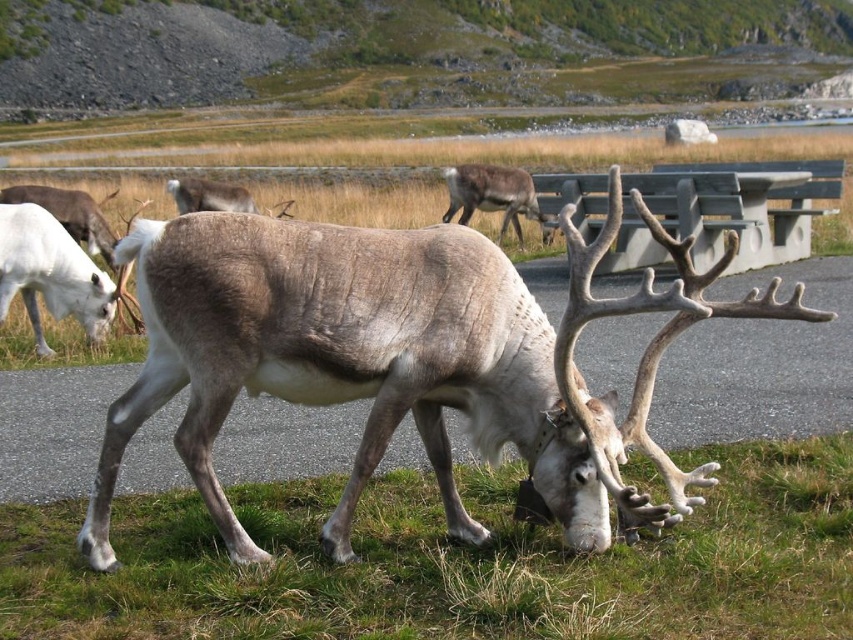
Question: Considering the relative positions of brown fur antlered deer at center and brown fur reindeer at center in the image provided, where is brown fur antlered deer at center located with respect to brown fur reindeer at center?

Choices:
 (A) left
 (B) right

Answer: (A)

Question: Which of the following is the farthest from the observer?

Choices:
 (A) (164, 508)
 (B) (521, 202)
 (C) (416, 291)

Answer: (B)

Question: Which object is positioned farthest from the brown fur reindeer at center?

Choices:
 (A) green grass at lower right
 (B) brown fur antlered deer at center

Answer: (B)

Question: Which object is the farthest from the green grass at lower right?

Choices:
 (A) brown fur reindeer at center
 (B) brown fur antlered deer at center

Answer: (A)

Question: Is the position of green grass at lower right less distant than that of brown fur reindeer at center?

Choices:
 (A) yes
 (B) no

Answer: (A)

Question: Does green grass at lower right come in front of brown fur antlered deer at center?

Choices:
 (A) yes
 (B) no

Answer: (B)